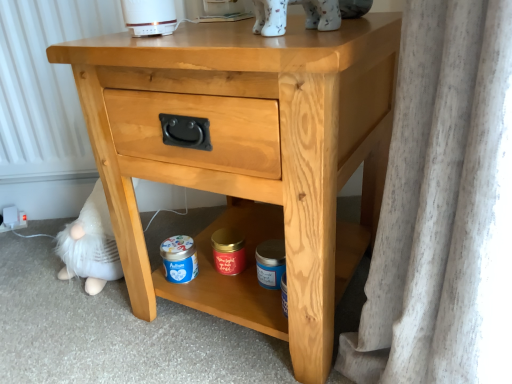
Question: Is blue matte jar at lower center to the left of white porcelain cat at upper center from the viewer's perspective?

Choices:
 (A) no
 (B) yes

Answer: (B)

Question: Is blue matte jar at lower center outside of white porcelain cat at upper center?

Choices:
 (A) no
 (B) yes

Answer: (B)

Question: Are blue matte jar at lower center and white porcelain cat at upper center located far from each other?

Choices:
 (A) yes
 (B) no

Answer: (B)

Question: From a real-world perspective, is blue matte jar at lower center under white porcelain cat at upper center?

Choices:
 (A) yes
 (B) no

Answer: (A)

Question: From the image's perspective, is blue matte jar at lower center located beneath white porcelain cat at upper center?

Choices:
 (A) yes
 (B) no

Answer: (A)

Question: Does blue matte jar at lower center have a larger size compared to white porcelain cat at upper center?

Choices:
 (A) no
 (B) yes

Answer: (A)

Question: Is blue matte jar at lower center far away from light wood nightstand at center?

Choices:
 (A) no
 (B) yes

Answer: (A)

Question: From the image's perspective, is blue matte jar at lower center on top of light wood nightstand at center?

Choices:
 (A) yes
 (B) no

Answer: (B)

Question: Is blue matte jar at lower center bigger than light wood nightstand at center?

Choices:
 (A) no
 (B) yes

Answer: (A)

Question: Can you confirm if blue matte jar at lower center is wider than light wood nightstand at center?

Choices:
 (A) yes
 (B) no

Answer: (B)

Question: Can you confirm if blue matte jar at lower center is taller than light wood nightstand at center?

Choices:
 (A) yes
 (B) no

Answer: (B)

Question: Is blue matte jar at lower center not inside light wood nightstand at center?

Choices:
 (A) no
 (B) yes

Answer: (A)

Question: From a real-world perspective, is white porcelain cat at upper center physically above red matte candle at center, placed as the second pottery when sorted from right to left?

Choices:
 (A) no
 (B) yes

Answer: (B)